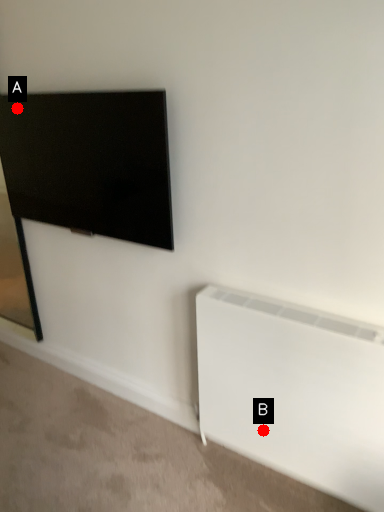
Question: Two points are circled on the image, labeled by A and B beside each circle. Which of the following is the farthest from the observer?

Choices:
 (A) A is further
 (B) B is further

Answer: (A)